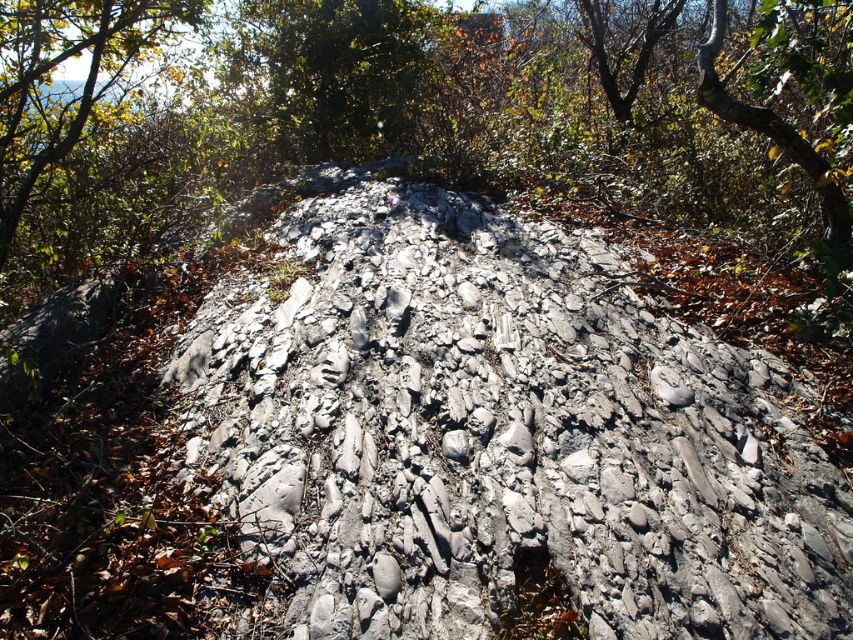
Between gray rocky dirt track at center and green leafy tree at upper center, which one appears on the left side from the viewer's perspective?

From the viewer's perspective, green leafy tree at upper center appears more on the left side.

Between gray rocky dirt track at center and green leafy tree at upper center, which one appears on the right side from the viewer's perspective?

From the viewer's perspective, gray rocky dirt track at center appears more on the right side.

At what (x,y) coordinates should I click in order to perform the action: click on gray rocky dirt track at center. Please return your answer as a coordinate pair (x, y). This screenshot has width=853, height=640. Looking at the image, I should click on (502, 435).

You are a GUI agent. You are given a task and a screenshot of the screen. Output one action in this format:
    pyautogui.click(x=<x>, y=<y>)
    Task: Click on the gray rocky dirt track at center
    
    Given the screenshot: What is the action you would take?
    pyautogui.click(x=502, y=435)